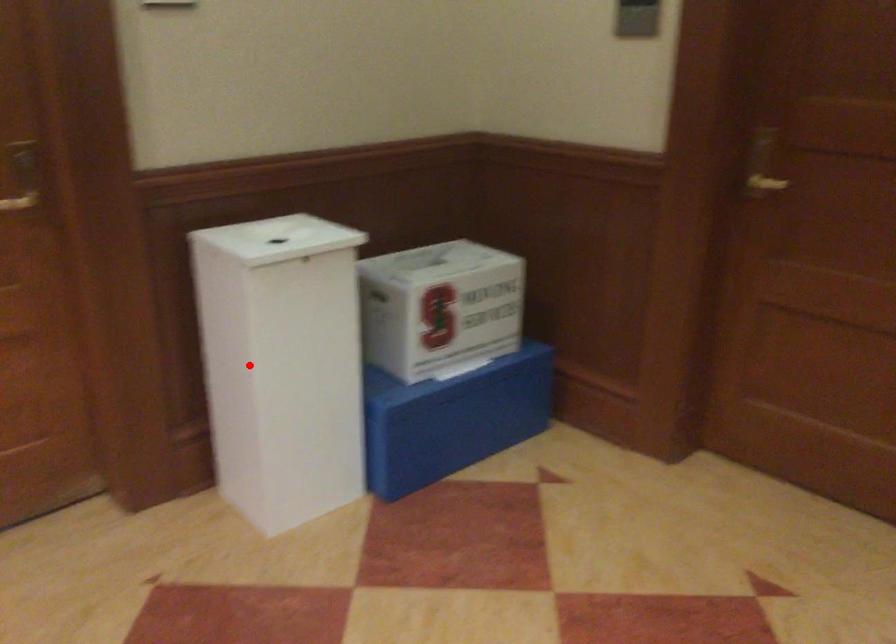
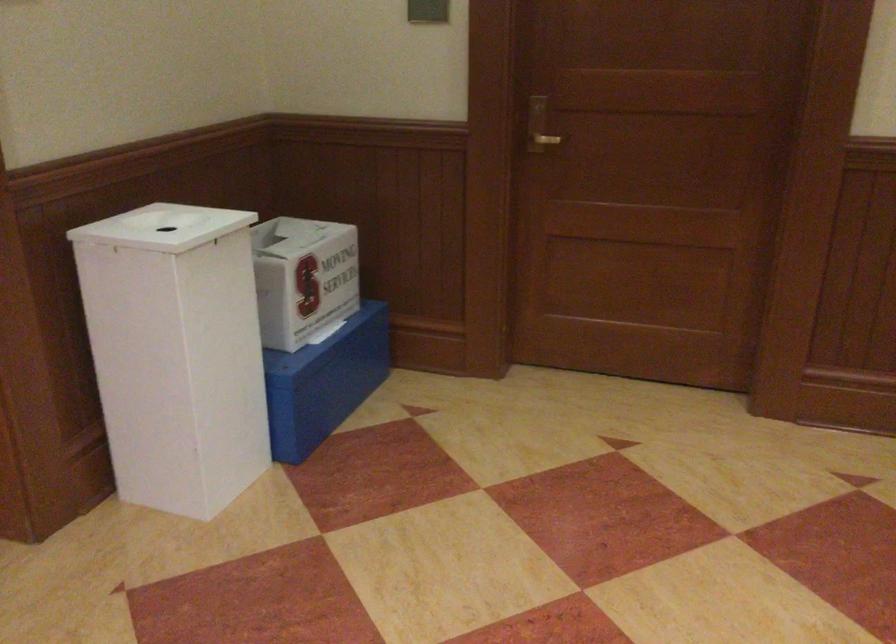
Locate, in the second image, the point that corresponds to the highlighted location in the first image.

(176, 353)